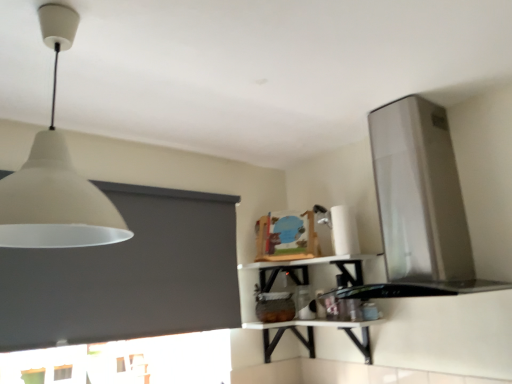
You are a GUI agent. You are given a task and a screenshot of the screen. Output one action in this format:
    pyautogui.click(x=<x>, y=<y>)
    Task: Click on the free location above white matte lampshade at upper left (from a real-world perspective)
    This screenshot has width=512, height=384.
    Given the screenshot: What is the action you would take?
    pyautogui.click(x=78, y=21)